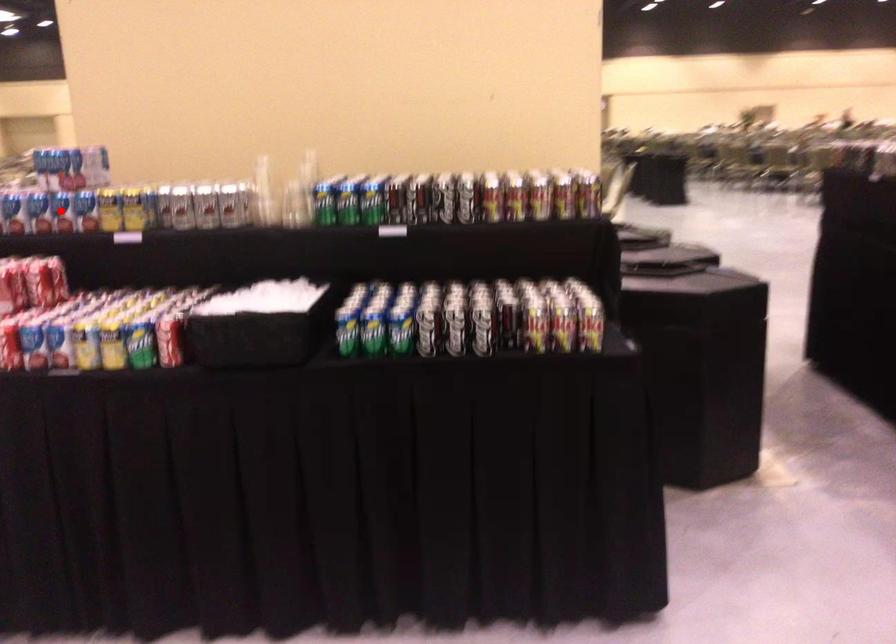
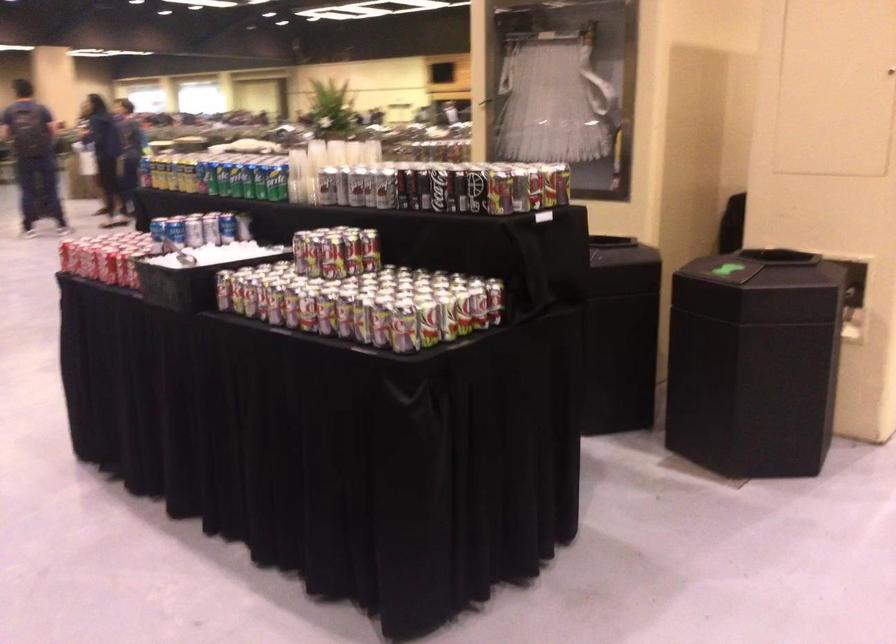
Question: I am providing you with two images of the same scene from different viewpoints. A red point is marked on the first image. Can you still see the location of the red point in image 2?

Choices:
 (A) Yes
 (B) No

Answer: (B)